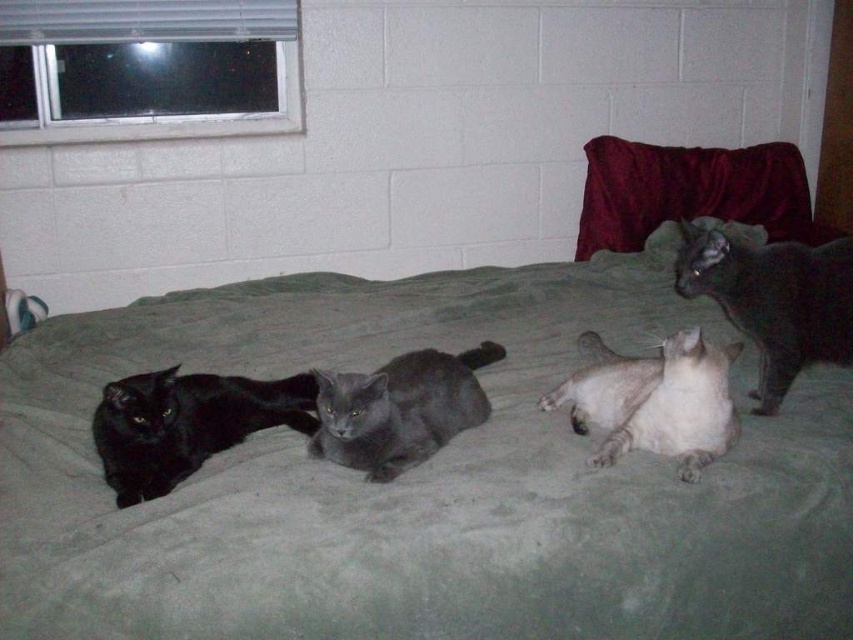
Question: Is green fabric bedcover at center wider than velvet-like dark red pillow at upper right?

Choices:
 (A) no
 (B) yes

Answer: (B)

Question: Among these objects, which one is farthest from the camera?

Choices:
 (A) white fur cat at center
 (B) matte black cat at left

Answer: (A)

Question: Estimate the real-world distances between objects in this image. Which object is closer to the silvery metallic cat at upper right?

Choices:
 (A) matte black cat at left
 (B) green fabric bedcover at center

Answer: (B)

Question: Considering the relative positions of velvet-like dark red pillow at upper right and white fur cat at center in the image provided, where is velvet-like dark red pillow at upper right located with respect to white fur cat at center?

Choices:
 (A) above
 (B) below

Answer: (A)

Question: Can you confirm if matte black cat at left is positioned below white fur cat at center?

Choices:
 (A) no
 (B) yes

Answer: (B)

Question: Which object is closer to the camera taking this photo?

Choices:
 (A) matte black cat at left
 (B) silvery metallic cat at upper right
 (C) green fabric bedcover at center
 (D) white fur cat at center

Answer: (C)